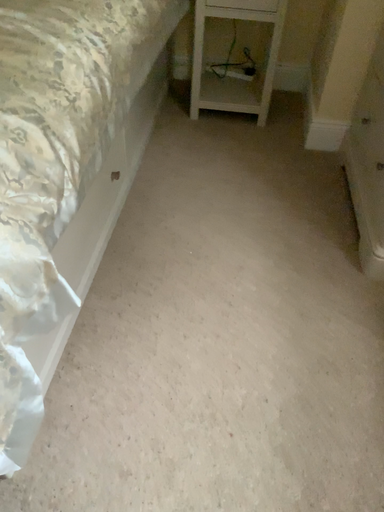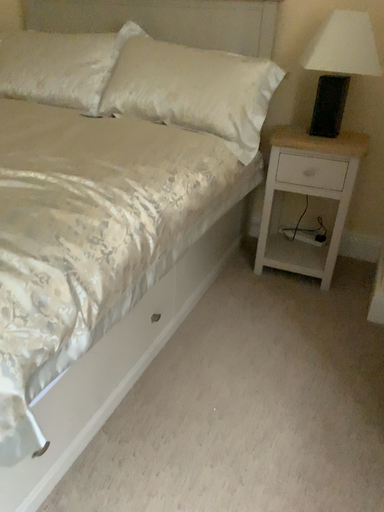
Question: How did the camera likely rotate when shooting the video?

Choices:
 (A) rotated left
 (B) rotated right

Answer: (A)